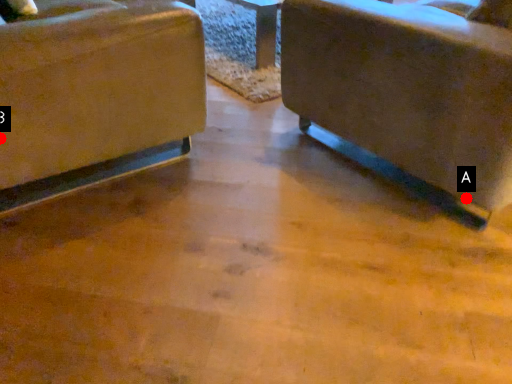
Question: Two points are circled on the image, labeled by A and B beside each circle. Which of the following is the closest to the observer?

Choices:
 (A) A is closer
 (B) B is closer

Answer: (B)